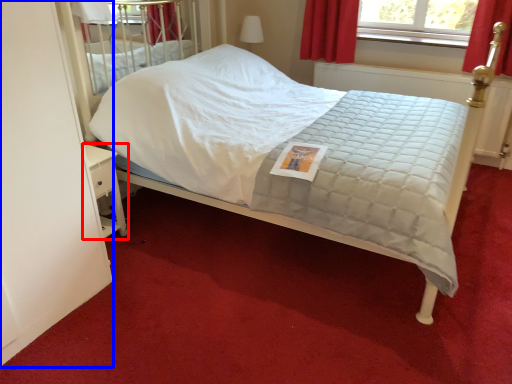
Question: Which object is closer to the camera taking this photo, nightstand (highlighted by a red box) or screen door (highlighted by a blue box)?

Choices:
 (A) nightstand
 (B) screen door

Answer: (B)